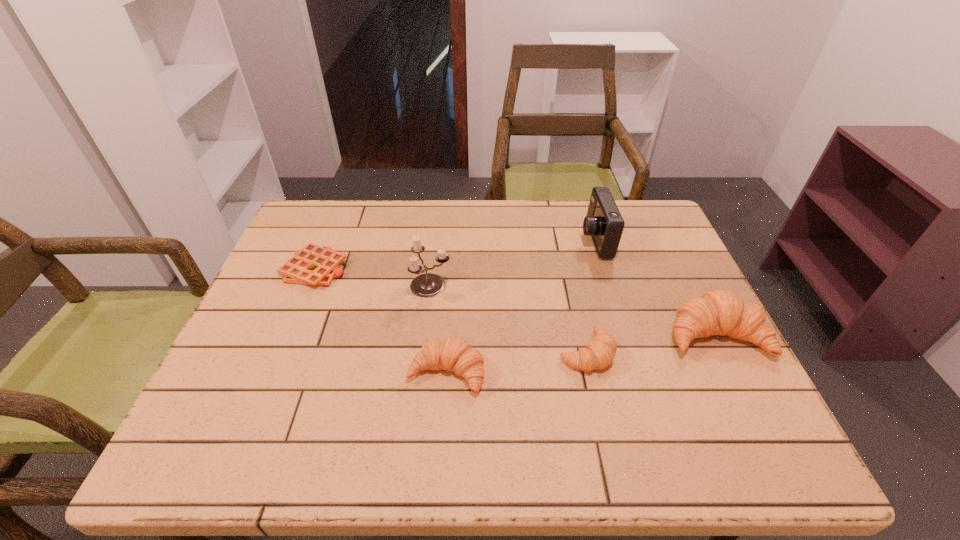
Where is `free space between the second tallest crescent roll and the leftmost object`? free space between the second tallest crescent roll and the leftmost object is located at coordinates (381, 321).

Locate an element on the screen. This screenshot has width=960, height=540. vacant area that lies between the candle holder and the leftmost crescent roll is located at coordinates (439, 329).

The width and height of the screenshot is (960, 540). In order to click on free spot between the candle holder and the waffle in this screenshot , I will do `click(372, 277)`.

I want to click on vacant area between the leftmost object and the rightmost object, so click(x=516, y=302).

Locate an element on the screen. The image size is (960, 540). unoccupied position between the candle holder and the leftmost object is located at coordinates (372, 277).

This screenshot has height=540, width=960. What are the coordinates of `free space between the shortest crescent roll and the candle holder` in the screenshot? It's located at pos(509,319).

The height and width of the screenshot is (540, 960). In order to click on free space between the fourth tallest object and the second crescent roll from left to right in this screenshot , I will do `click(516, 362)`.

I want to click on free space between the leftmost object and the leftmost crescent roll, so click(381, 321).

Select which object appears as the fourth closest to the second tallest crescent roll. Please provide its 2D coordinates. Your answer should be formatted as a tuple, i.e. [(x, y)], where the tuple contains the x and y coordinates of a point satisfying the conditions above.

[(604, 223)]

Where is `the fifth closest object to the rightmost object`? This screenshot has width=960, height=540. the fifth closest object to the rightmost object is located at coordinates (314, 265).